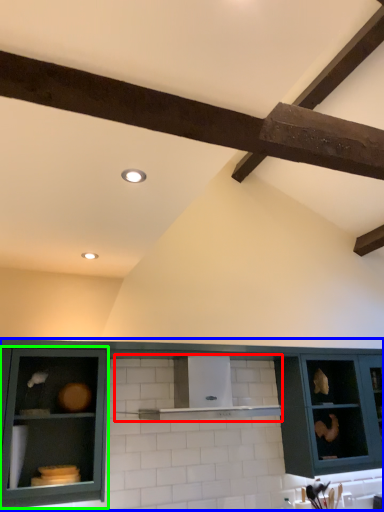
Question: Which is nearer to the shelf (highlighted by a red box)? cabinetry (highlighted by a blue box) or cabinetry (highlighted by a green box).

Choices:
 (A) cabinetry
 (B) cabinetry

Answer: (A)